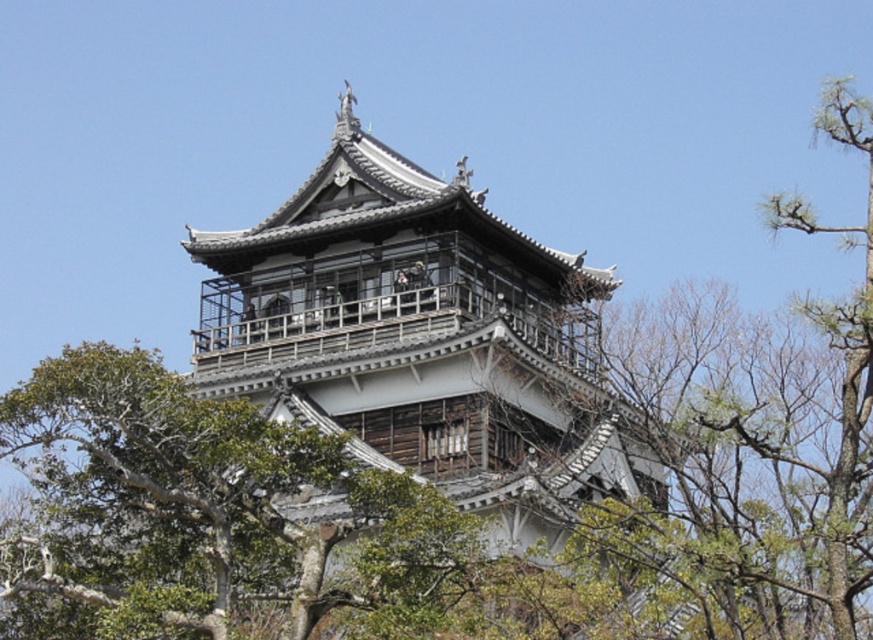
You are standing in front of the gray wooden pagoda at center and want to take a photo of the green leafy tree at upper right. Since the pagoda is between you and the tree, will the tree be partially hidden by the pagoda in your photo?

The gray wooden pagoda at center is further to the viewer than the green leafy tree at upper right, so the tree is behind the pagoda. Therefore, the tree will be partially hidden by the pagoda in your photo.

You are standing in front of the pagoda and want to take a photo that includes both point (550, 296) and point (658, 577). Considering their positions, which point is closer to your camera when you take the picture?

Point (658, 577) is closer to the camera than point (550, 296) because the description states that point (550, 296) is further away from the camera compared to point (658, 577).